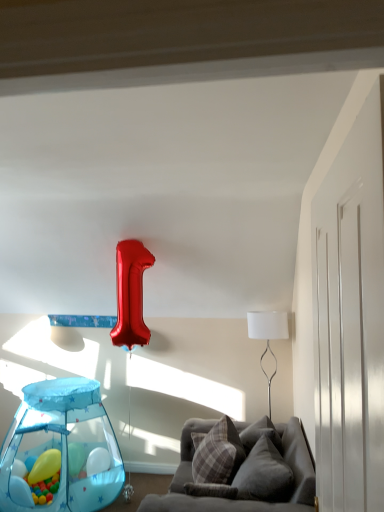
Question: From the image's perspective, is translucent plastic play tent at lower left located above translucent blue balloon at lower left, the second balloon positioned from the back?

Choices:
 (A) no
 (B) yes

Answer: (B)

Question: From a real-world perspective, does translucent plastic play tent at lower left stand above translucent blue balloon at lower left, the second balloon positioned from the back?

Choices:
 (A) no
 (B) yes

Answer: (B)

Question: Is translucent plastic play tent at lower left thinner than translucent blue balloon at lower left, which is the first balloon from front to back?

Choices:
 (A) yes
 (B) no

Answer: (B)

Question: Considering the relative sizes of translucent plastic play tent at lower left and translucent blue balloon at lower left, the second balloon positioned from the back, in the image provided, is translucent plastic play tent at lower left wider than translucent blue balloon at lower left, the second balloon positioned from the back,?

Choices:
 (A) no
 (B) yes

Answer: (B)

Question: From the image's perspective, is translucent plastic play tent at lower left under translucent blue balloon at lower left, which is the first balloon from front to back?

Choices:
 (A) yes
 (B) no

Answer: (B)

Question: Could you tell me if translucent plastic play tent at lower left is facing translucent blue balloon at lower left, the second balloon positioned from the back?

Choices:
 (A) yes
 (B) no

Answer: (A)

Question: Can you confirm if translucent blue balloon at lower left, which is the first balloon from front to back, is wider than rubber yellow ball at lower left, positioned as the 1th balloon in back-to-front order?

Choices:
 (A) no
 (B) yes

Answer: (A)

Question: Does translucent blue balloon at lower left, which is the first balloon from front to back, turn towards rubber yellow ball at lower left, the 2th balloon when ordered from front to back?

Choices:
 (A) no
 (B) yes

Answer: (A)

Question: Is translucent blue balloon at lower left, the second balloon positioned from the back, with rubber yellow ball at lower left, the 2th balloon when ordered from front to back?

Choices:
 (A) no
 (B) yes

Answer: (A)

Question: Considering the relative positions of translucent blue balloon at lower left, which is the first balloon from front to back, and rubber yellow ball at lower left, the 2th balloon when ordered from front to back, in the image provided, is translucent blue balloon at lower left, which is the first balloon from front to back, to the left of rubber yellow ball at lower left, the 2th balloon when ordered from front to back, from the viewer's perspective?

Choices:
 (A) yes
 (B) no

Answer: (A)

Question: Does translucent blue balloon at lower left, which is the first balloon from front to back, lie behind rubber yellow ball at lower left, positioned as the 1th balloon in back-to-front order?

Choices:
 (A) no
 (B) yes

Answer: (A)

Question: From the image's perspective, is translucent blue balloon at lower left, which is the first balloon from front to back, beneath rubber yellow ball at lower left, positioned as the 1th balloon in back-to-front order?

Choices:
 (A) no
 (B) yes

Answer: (A)

Question: Is white fabric lampshade at upper right closer to the viewer compared to plaid fabric pillow at center, placed as the 1th pillow when sorted from back to front?

Choices:
 (A) yes
 (B) no

Answer: (B)